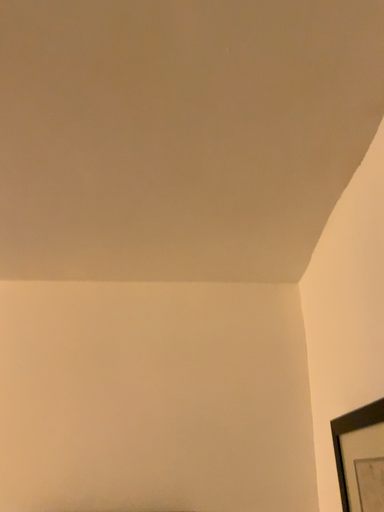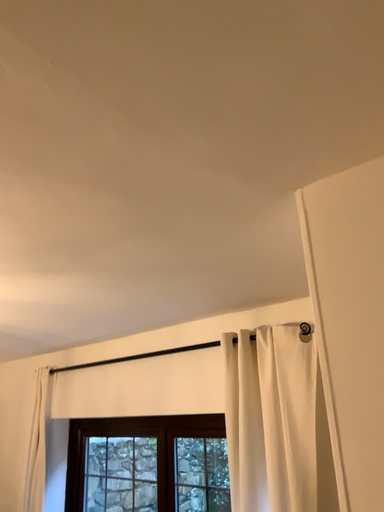
Question: How did the camera likely rotate when shooting the video?

Choices:
 (A) rotated right
 (B) rotated left

Answer: (B)